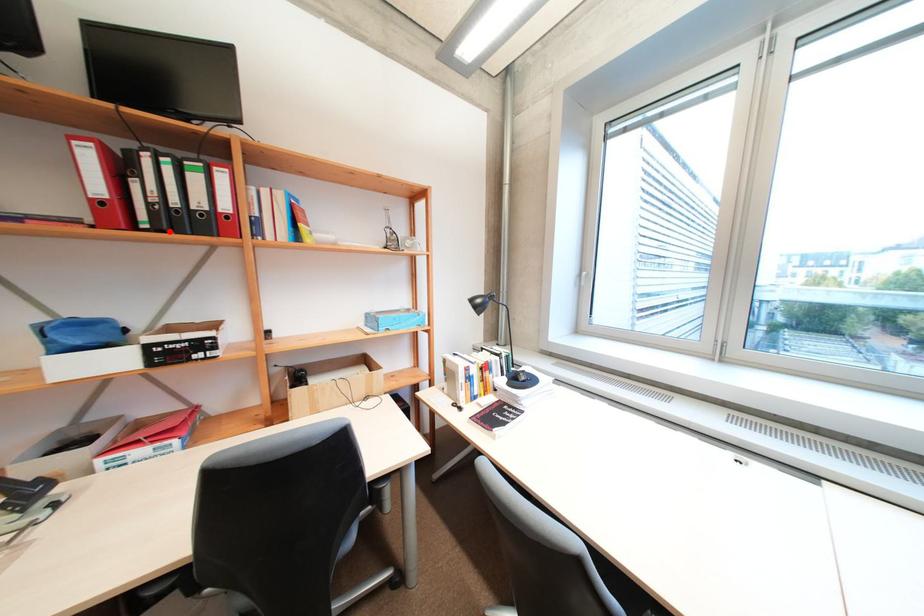
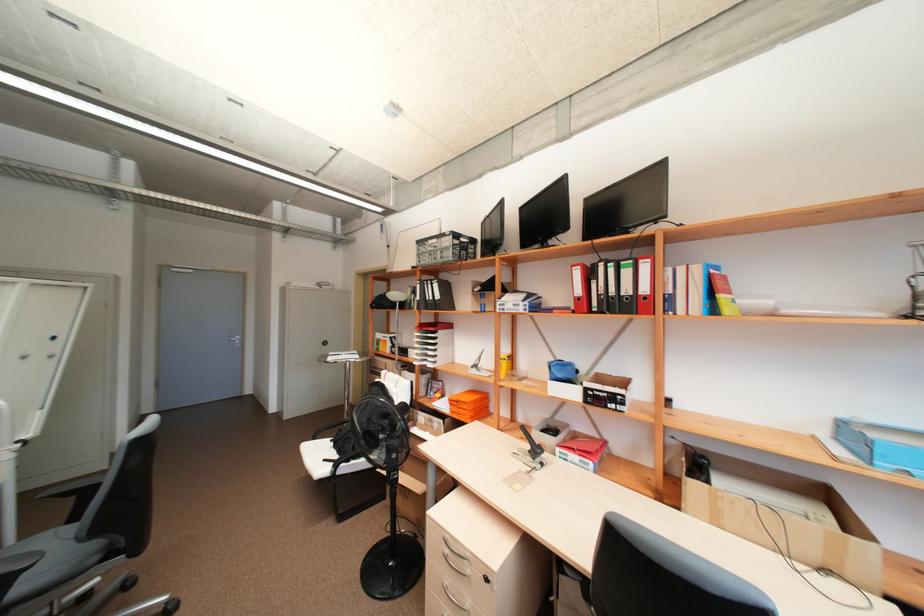
Find the pixel in the second image that matches the highlighted location in the first image.

(610, 313)